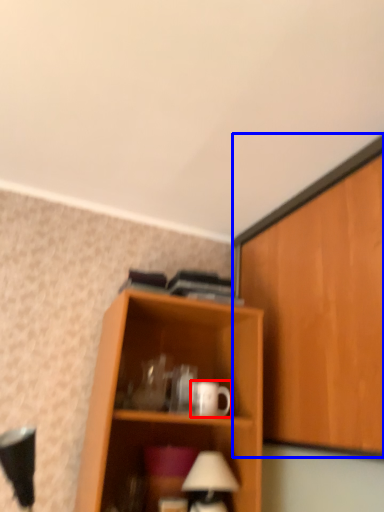
Question: Which object is closer to the camera taking this photo, mug (highlighted by a red box) or cabinetry (highlighted by a blue box)?

Choices:
 (A) mug
 (B) cabinetry

Answer: (B)